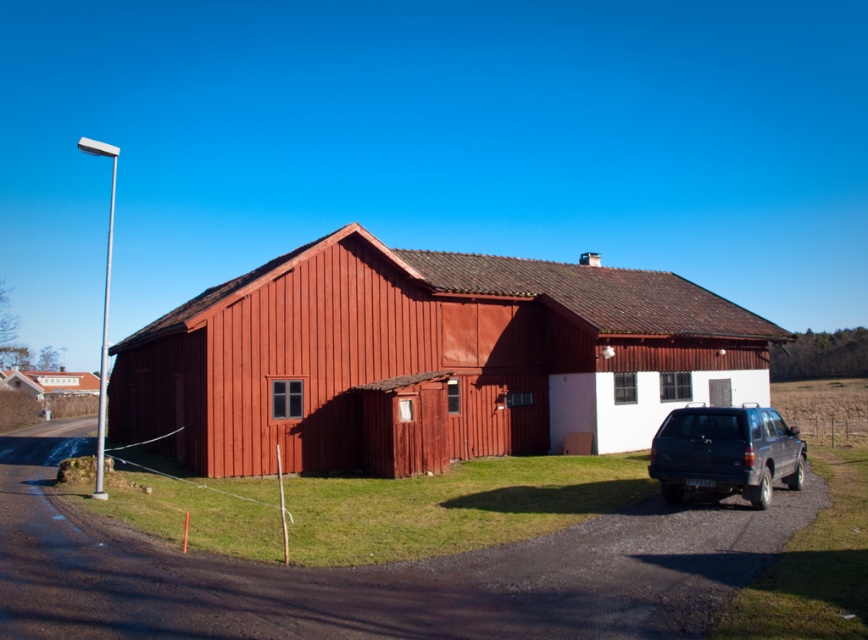
Based on the photo, you are planning to park another matte black suv next to the existing one. Given the scene, can the new suv fit alongside the matte black suv at lower right without overlapping the smooth wooden barn at center?

The smooth wooden barn at center is wider than the matte black suv at lower right. Since the barn is wider, there might be enough space to park another matte black suv next to the existing one, but it depends on the total available space along the driveway. However, the description only mentions the barn being wider than the SUV, not the driveway dimensions. Therefore, we cannot confirm if the new SUV will fit without more information about the driveway width.

Based on the photo, you are standing at the point marked as point (426, 355) in the image. Looking around, you see the smooth wooden barn at center. What is directly beneath your feet?

The point (426, 355) is where the smooth wooden barn at center is located, so standing there would mean you are directly on top of the smooth wooden barn at center.

You are a delivery person who needs to park your 5.0 meters long truck between the smooth wooden barn at center and the matte black suv at lower right. Is there enough space for your truck to fit between them?

The distance between the smooth wooden barn at center and the matte black suv at lower right is 9.70 meters. Since your truck is 5.0 meters long, there is sufficient space for it to fit between them as 9.70 meters is greater than 5.0 meters.